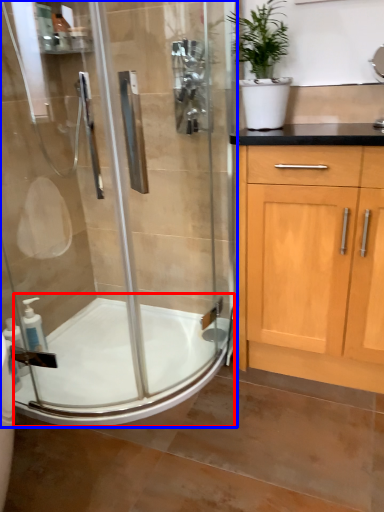
Question: Which of the following is the farthest to the observer, bath (highlighted by a red box) or shower door (highlighted by a blue box)?

Choices:
 (A) bath
 (B) shower door

Answer: (A)